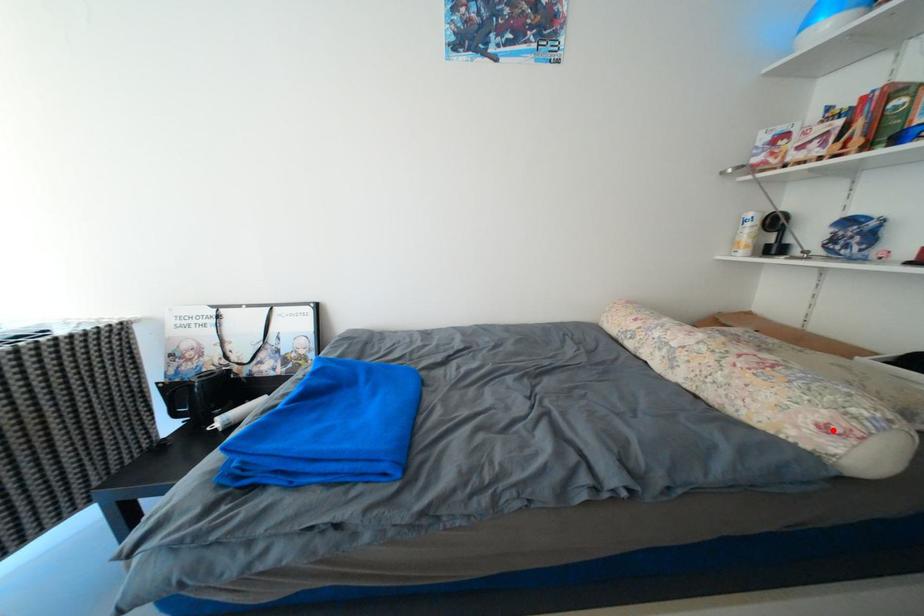
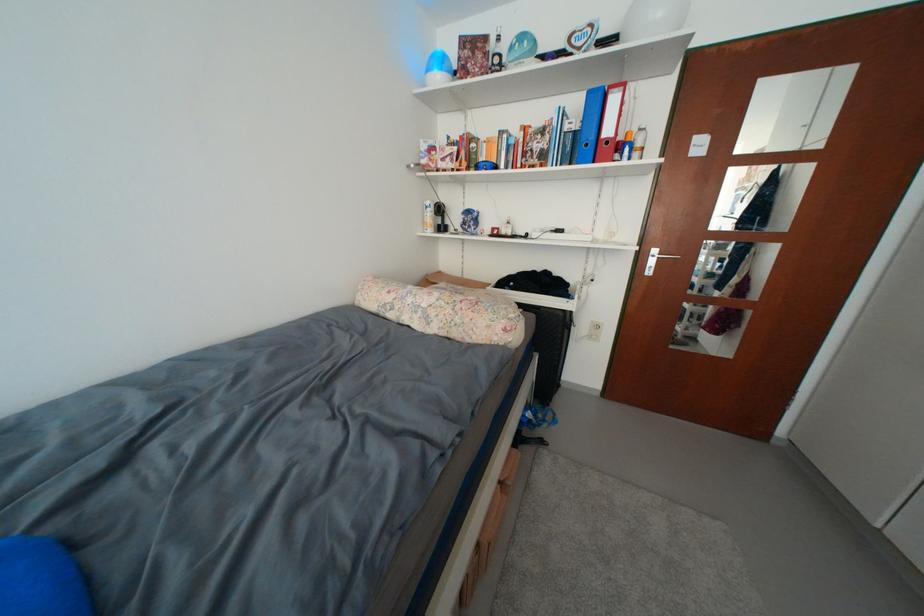
The point at the highlighted location is marked in the first image. Where is the corresponding point in the second image?

(514, 331)